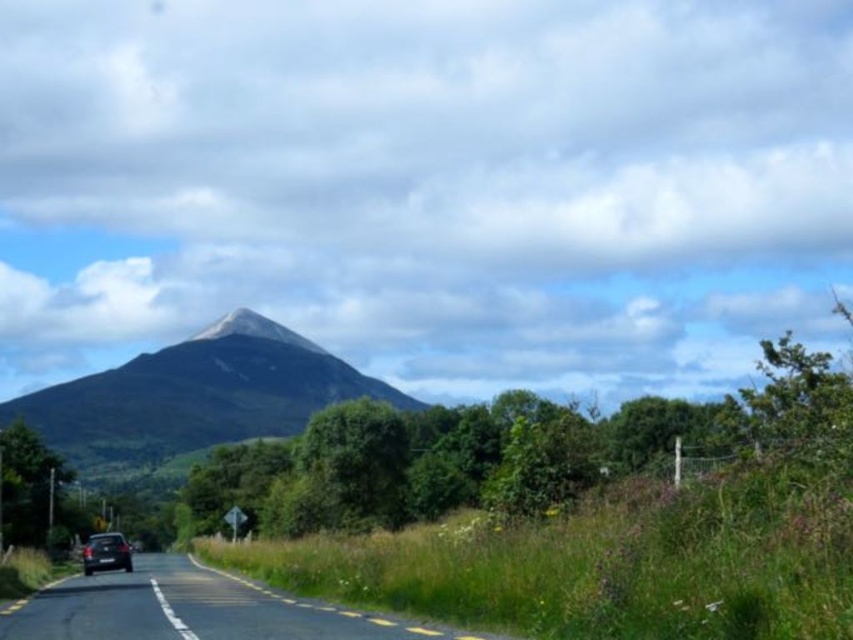
Question: Does green grassy mountain at center lie behind shiny black car at lower left?

Choices:
 (A) no
 (B) yes

Answer: (B)

Question: Which object is closer to the camera taking this photo?

Choices:
 (A) shiny black car at lower left
 (B) green grassy mountain at center

Answer: (A)

Question: Does green grassy mountain at center have a smaller size compared to shiny black car at lower left?

Choices:
 (A) no
 (B) yes

Answer: (A)

Question: Which point is farther to the camera?

Choices:
 (A) shiny black car at lower left
 (B) green grassy mountain at center

Answer: (B)

Question: Is green grassy mountain at center above shiny black car at lower left?

Choices:
 (A) yes
 (B) no

Answer: (A)